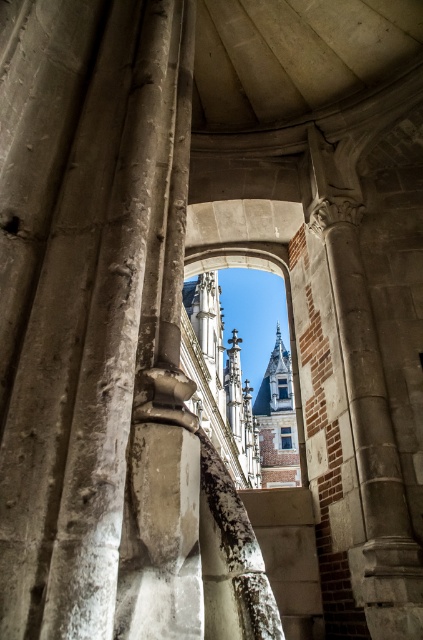
Question: Which point is closer to the camera taking this photo?

Choices:
 (A) (290, 432)
 (B) (285, 378)

Answer: (A)

Question: Which object is farther from the camera taking this photo?

Choices:
 (A) blue glass window at center
 (B) clear glass window at center

Answer: (B)

Question: Is blue glass window at center smaller than clear glass window at center?

Choices:
 (A) no
 (B) yes

Answer: (B)

Question: Does blue glass window at center come behind clear glass window at center?

Choices:
 (A) no
 (B) yes

Answer: (A)

Question: Among these objects, which one is farthest from the camera?

Choices:
 (A) blue glass window at center
 (B) clear glass window at center

Answer: (B)

Question: Does blue glass window at center come in front of clear glass window at center?

Choices:
 (A) yes
 (B) no

Answer: (A)